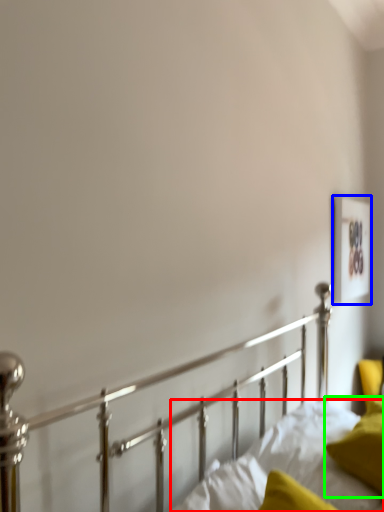
Question: Which object is positioned farthest from mattress (highlighted by a red box)? Select from picture frame (highlighted by a blue box) and pillow (highlighted by a green box).

Choices:
 (A) picture frame
 (B) pillow

Answer: (A)